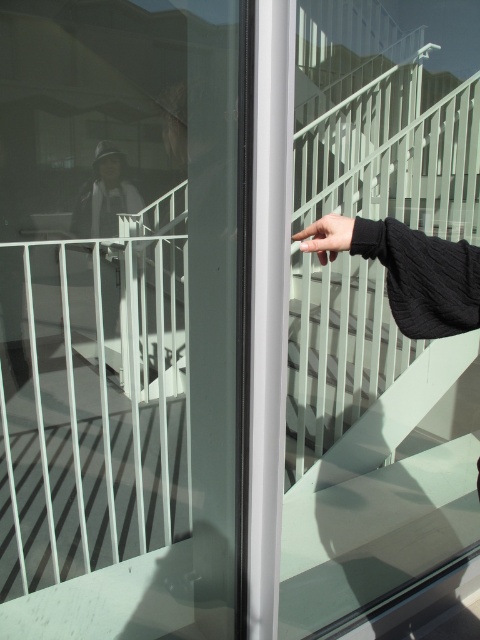
Looking at this image, you are trying to open the transparent glass screen door at center with your black matte hand at center. Can your hand fit through the door without touching the sides?

The transparent glass screen door at center is wider than the black matte hand at center, so yes, the hand can fit through the door without touching the sides.

You are trying to open the transparent glass screen door at center but notice your black matte hand at center is blocking the handle. Is your hand above or below the door handle?

The transparent glass screen door at center is located below the black matte hand at center, so the hand is above the door handle.

You are a delivery person approaching the entrance of a building. You see a transparent glass screen door at center and a black matte hand at center. Which object is closer to the left side of the entrance?

The transparent glass screen door at center is closer to the left side of the entrance because it is positioned to the left of the black matte hand at center.